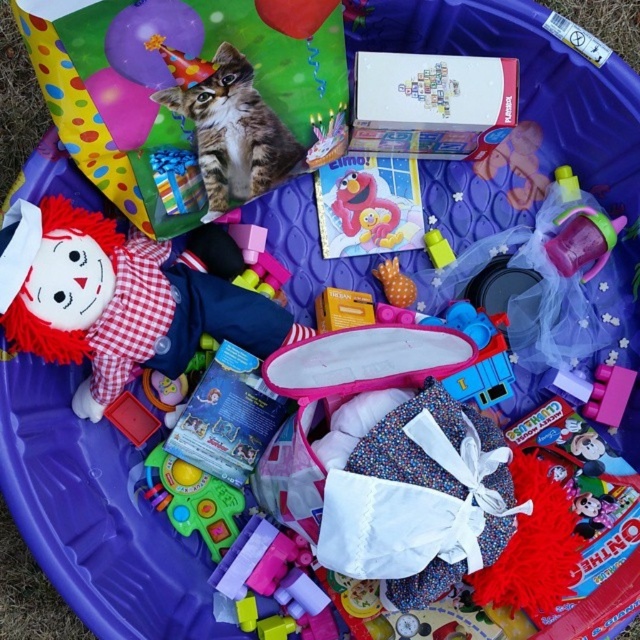
Is fuzzy fabric doll at left to the right of translucent plastic cup at center from the viewer's perspective?

Incorrect, fuzzy fabric doll at left is not on the right side of translucent plastic cup at center.

From the picture: Measure the distance between point (140, 280) and camera.

Point (140, 280) and camera are 1.09 meters apart.

The image size is (640, 640). What do you see at coordinates (122, 301) in the screenshot?
I see `fuzzy fabric doll at left` at bounding box center [122, 301].

Image resolution: width=640 pixels, height=640 pixels. Identify the location of fuzzy fabric doll at left. (122, 301).

Between point (353, 236) and point (429, 230), which one is positioned behind?

The point (353, 236) is more distant.

Does matte pink plush elmo at center appear on the right side of translucent plastic cup at center?

Incorrect, matte pink plush elmo at center is not on the right side of translucent plastic cup at center.

Where is `matte pink plush elmo at center`? matte pink plush elmo at center is located at coordinates (365, 212).

Is matte pink plush elmo at center positioned before orange dotted fabric at center?

No.

Does matte pink plush elmo at center have a smaller size compared to orange dotted fabric at center?

Yes.

Between point (372, 221) and point (408, 298), which one is positioned in front?

Point (408, 298) is more forward.

Locate an element on the screen. The height and width of the screenshot is (640, 640). matte pink plush elmo at center is located at coordinates (365, 212).